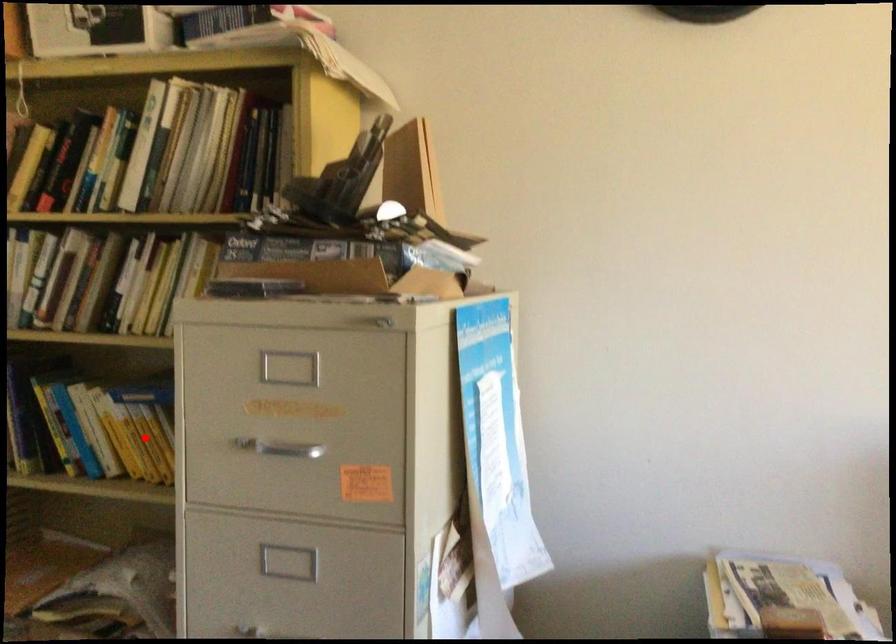
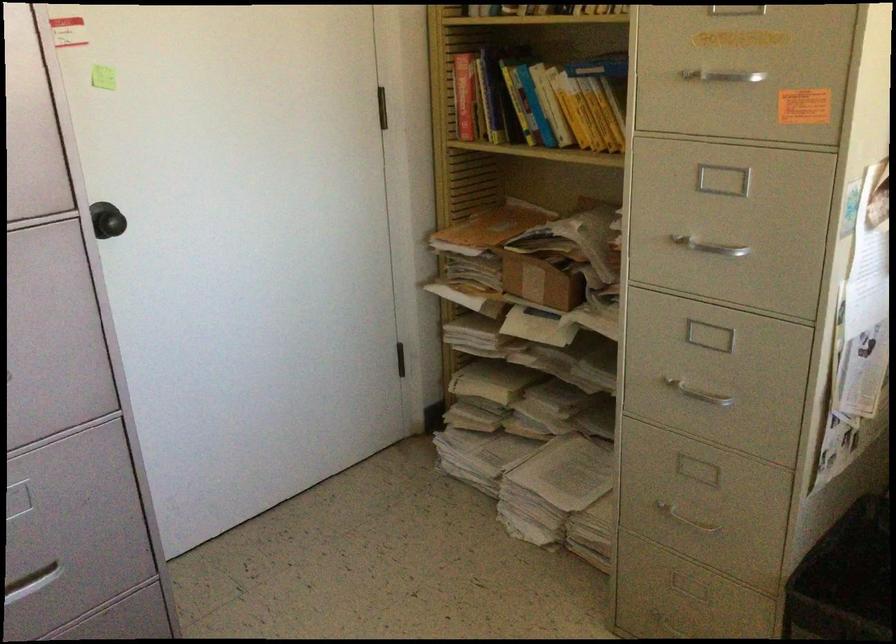
The point at the highlighted location is marked in the first image. Where is the corresponding point in the second image?

(590, 114)